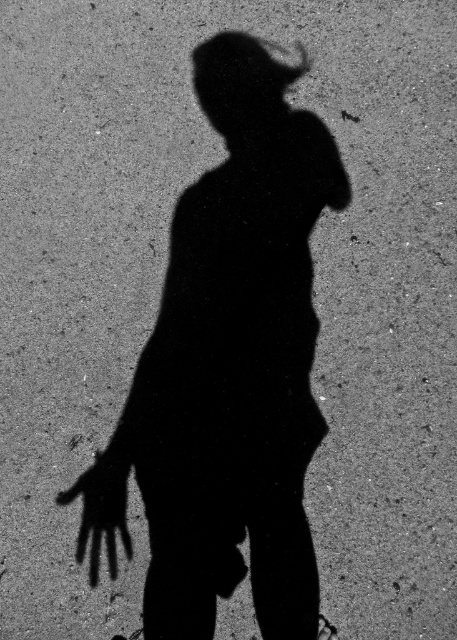
You are a photographer analyzing the shadow in the image. You notice two points marked as point 1 at coordinates (x=271, y=620) and point 2 at (x=88, y=524). Based on their positions, which point is closer to the camera?

Point 1 at coordinates (x=271, y=620) is closer to the camera because it is in front of point 2 at (x=88, y=524).

You are a detective examining the scene and notice two black shapes on the ground. You see the black shadow girl at center and the black matte hand at center. Which one do you think is larger?

The black shadow girl at center is bigger than the black matte hand at center, so the shadow girl is larger.